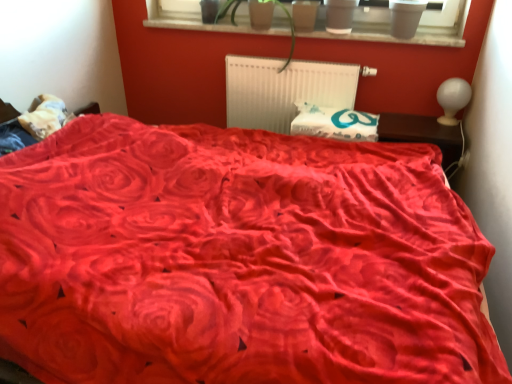
Question: From a real-world perspective, does white glossy lampshade at upper right sit lower than matte plastic pots at upper center?

Choices:
 (A) yes
 (B) no

Answer: (A)

Question: Considering the relative sizes of white glossy lampshade at upper right and matte plastic pots at upper center in the image provided, is white glossy lampshade at upper right shorter than matte plastic pots at upper center?

Choices:
 (A) yes
 (B) no

Answer: (B)

Question: Is matte plastic pots at upper center located within white glossy lampshade at upper right?

Choices:
 (A) no
 (B) yes

Answer: (A)

Question: Are white glossy lampshade at upper right and matte plastic pots at upper center located far from each other?

Choices:
 (A) yes
 (B) no

Answer: (B)

Question: Considering the relative sizes of white glossy lampshade at upper right and matte plastic pots at upper center in the image provided, is white glossy lampshade at upper right bigger than matte plastic pots at upper center?

Choices:
 (A) no
 (B) yes

Answer: (A)

Question: Is white glossy lampshade at upper right taller than matte plastic pots at upper center?

Choices:
 (A) no
 (B) yes

Answer: (B)

Question: From the image's perspective, does matte plastic pots at upper center appear lower than matte gray flowerpot at upper center, marked as the 2th flowerpot in a left-to-right arrangement?

Choices:
 (A) no
 (B) yes

Answer: (A)

Question: Can you confirm if matte plastic pots at upper center is wider than matte gray flowerpot at upper center, marked as the 2th flowerpot in a left-to-right arrangement?

Choices:
 (A) no
 (B) yes

Answer: (A)

Question: Is matte plastic pots at upper center oriented away from matte gray flowerpot at upper center, the first flowerpot from the right?

Choices:
 (A) no
 (B) yes

Answer: (B)

Question: Is matte plastic pots at upper center smaller than matte gray flowerpot at upper center, marked as the 2th flowerpot in a left-to-right arrangement?

Choices:
 (A) no
 (B) yes

Answer: (A)

Question: Is matte plastic pots at upper center not close to matte gray flowerpot at upper center, the first flowerpot from the right?

Choices:
 (A) no
 (B) yes

Answer: (A)

Question: Is matte plastic pots at upper center placed right next to matte gray flowerpot at upper center, the first flowerpot from the right?

Choices:
 (A) no
 (B) yes

Answer: (A)

Question: Does matte plastic pots at upper center contain white glossy lampshade at upper right?

Choices:
 (A) no
 (B) yes

Answer: (A)